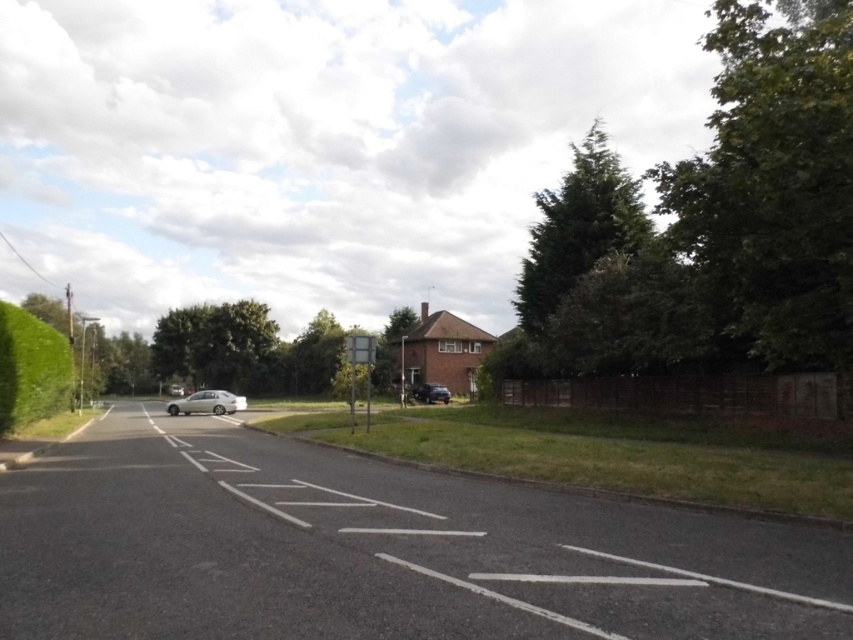
In the scene shown: You are a delivery driver who needs to navigate a narrow alley that is only 2 meters wide. You see the silver metallic car at center and the metallic gray street sign at center in the image. Can both the car and the street sign fit side by side in the alley without overlapping?

The silver metallic car at center might be wider than metallic gray street sign at center. If the car is wider than the alley, they cannot fit side by side. Please check the exact widths before proceeding.

In the scene shown: You are a drone operator trying to capture aerial footage of the suburban street scene. The camera has a 180 degree field of view. If you position the camera so that the center of the view is at the coordinates of the green leafy tree at upper right, will the silver car parked on the left side of the road near the center be visible in the footage?

The green leafy tree at upper right is located at coordinates (579, 227). The silver car parked on the left side of the road near the center would be positioned in a different area of the image. Since the camera has a 180 degree field of view, if the center is set to the tree, the car might still be within the left half of the frame. However without exact coordinate calculations, it is uncertain. The question cannot be definitively answered with the provided information.